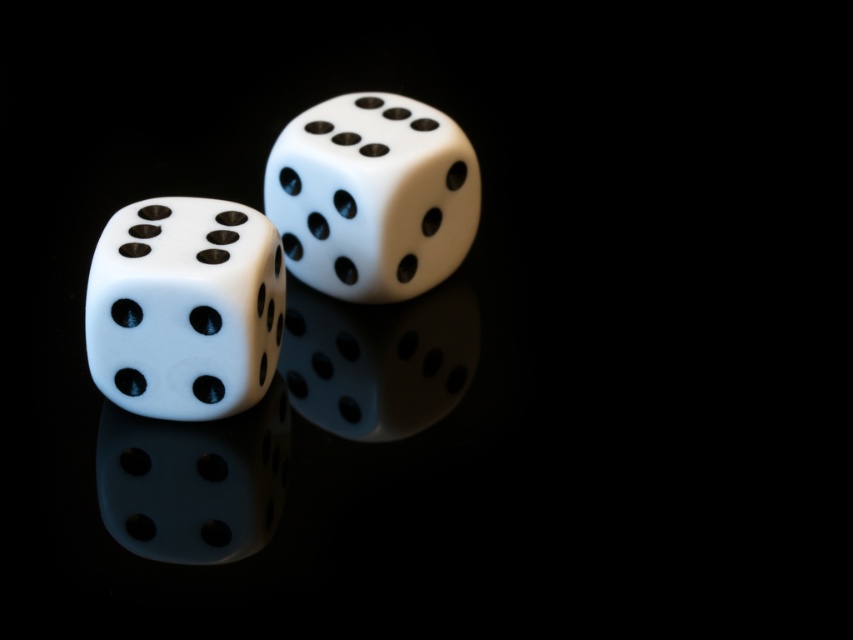
Between matte white dice at left and matte white dice at center, which one has less height?

Standing shorter between the two is matte white dice at left.

Is matte white dice at left shorter than matte white dice at center?

Indeed, matte white dice at left has a lesser height compared to matte white dice at center.

Who is more forward, (x=254, y=230) or (x=363, y=289)?

Point (x=254, y=230) is in front.

Identify the location of matte white dice at left. The width and height of the screenshot is (853, 640). (184, 307).